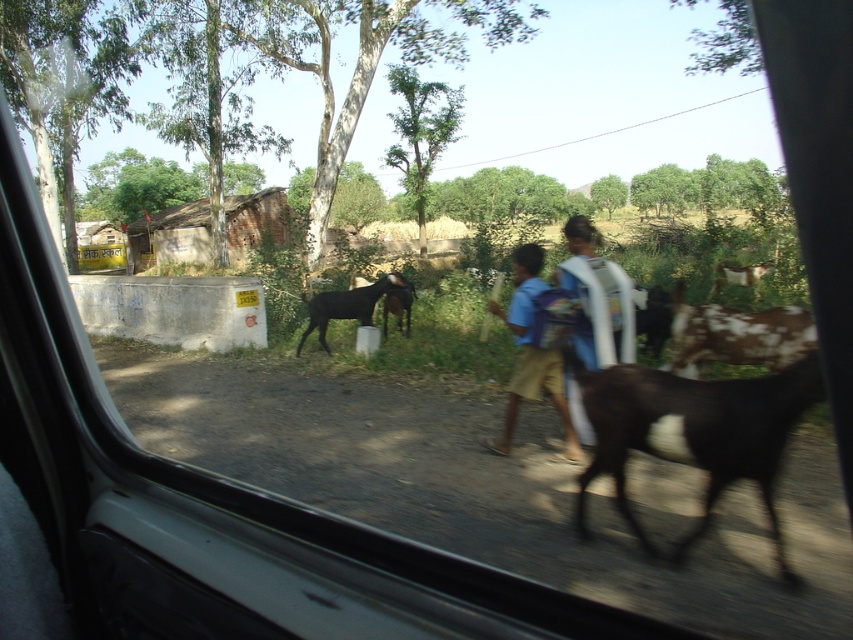
You are a photographer trying to capture both the black fur goat at right and the black fur goat at center in a single frame. Based on their widths, which goat might require more space in the composition?

The black fur goat at right might require more space in the composition because it is wider than the black fur goat at center according to the description.

You are inside a car and looking out the window. You see two people walking along a dirt path. One has a light blue shirt and is carrying a white object. The other is in darker clothes. There is a point marked at coordinates (x=531, y=355). Which person is at that point?

The point at (x=531, y=355) corresponds to the blue cotton shirt at center, so the person with the light blue shirt is at that point.